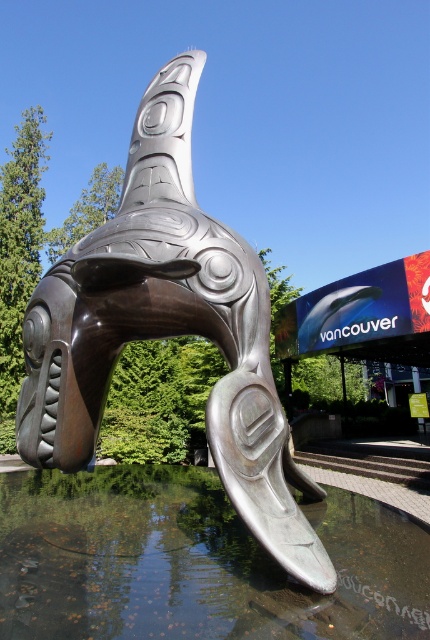
Question: Does shiny bronze orca at center lie behind glossy reflective water at lower center?

Choices:
 (A) yes
 (B) no

Answer: (A)

Question: Considering the relative positions of shiny bronze orca at center and glossy reflective water at lower center in the image provided, where is shiny bronze orca at center located with respect to glossy reflective water at lower center?

Choices:
 (A) below
 (B) above

Answer: (B)

Question: Which of the following is the farthest from the observer?

Choices:
 (A) shiny bronze orca at center
 (B) glossy reflective water at lower center

Answer: (A)

Question: Which of the following is the farthest from the observer?

Choices:
 (A) shiny bronze orca at center
 (B) glossy reflective water at lower center

Answer: (A)

Question: Which object appears farthest from the camera in this image?

Choices:
 (A) glossy reflective water at lower center
 (B) shiny bronze orca at center

Answer: (B)

Question: Considering the relative positions of shiny bronze orca at center and glossy reflective water at lower center in the image provided, where is shiny bronze orca at center located with respect to glossy reflective water at lower center?

Choices:
 (A) below
 (B) above

Answer: (B)